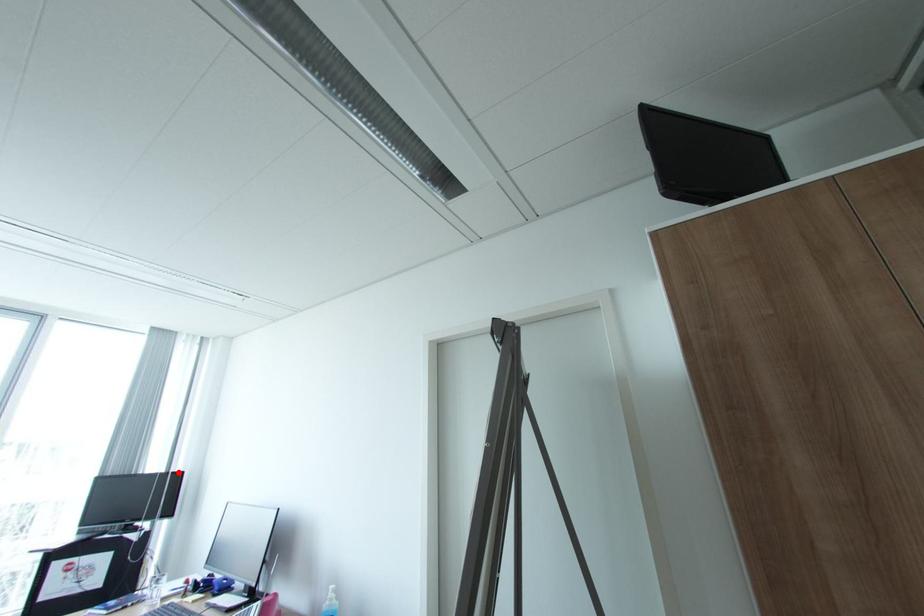
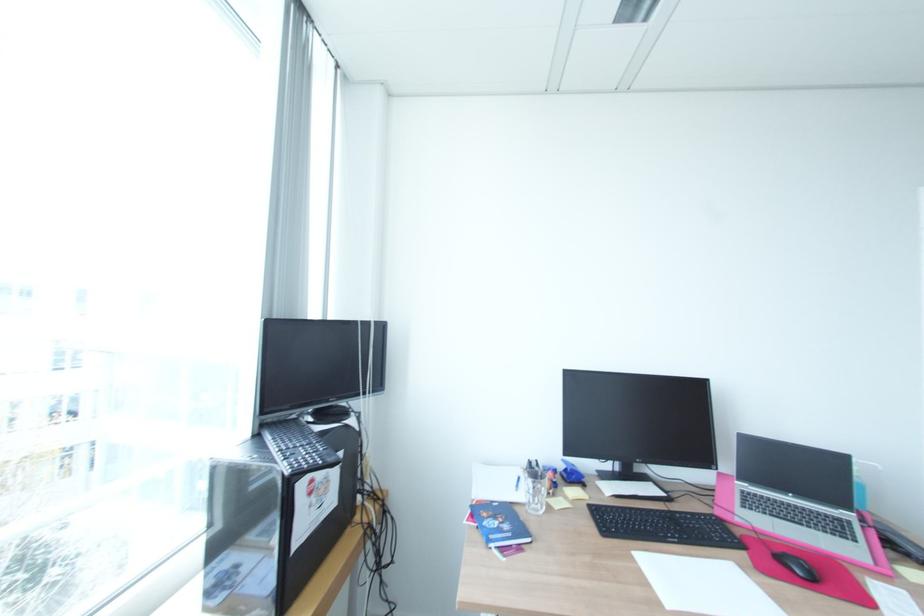
In the second image, find the point that corresponds to the highlighted location in the first image.

(381, 321)